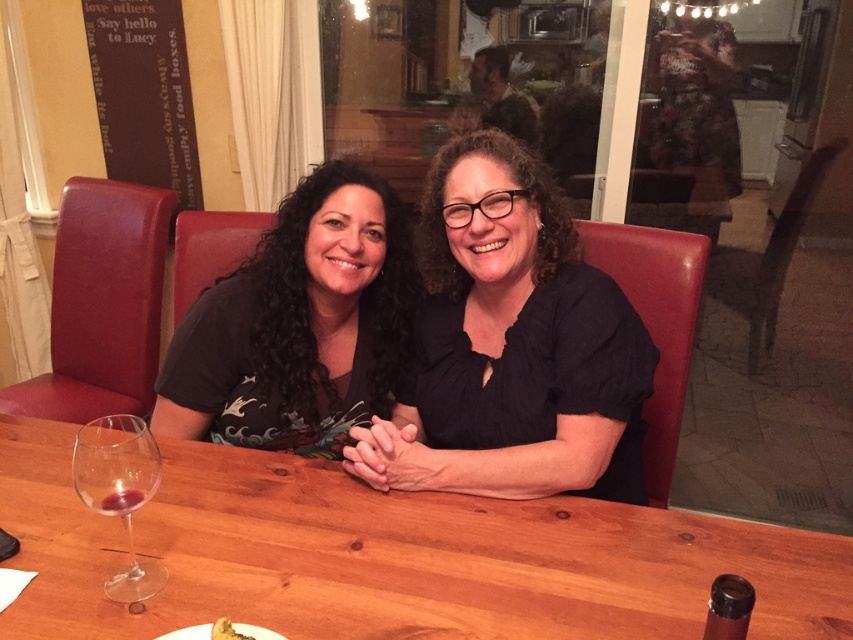
Question: Which object is positioned farthest from the matte black shirt at center?

Choices:
 (A) clear glass wine at lower left
 (B) black matte shirt at center

Answer: (A)

Question: Does black matte shirt at center appear under matte black shirt at center?

Choices:
 (A) yes
 (B) no

Answer: (A)

Question: Which point appears closest to the camera in this image?

Choices:
 (A) (339, 262)
 (B) (231, 630)
 (C) (512, 189)
 (D) (271, 554)

Answer: (B)

Question: Does matte black shirt at center have a lesser width compared to brown paper at upper left?

Choices:
 (A) no
 (B) yes

Answer: (A)

Question: Does black matte shirt at center appear on the right side of clear glass wine at lower left?

Choices:
 (A) yes
 (B) no

Answer: (A)

Question: Based on their relative distances, which object is nearer to the brown paper at upper left?

Choices:
 (A) transparent glass wine glass at lower left
 (B) yellow crumbly bread at lower center

Answer: (A)